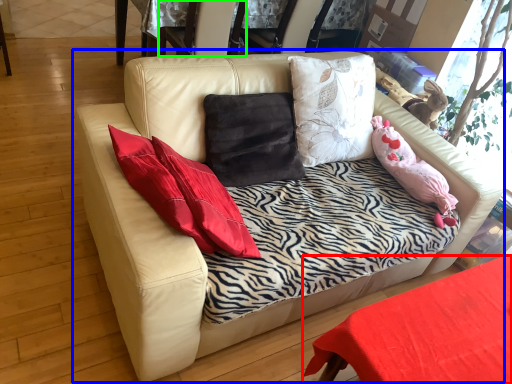
Question: Which object is positioned closest to table (highlighted by a red box)? Select from studio couch (highlighted by a blue box) and armchair (highlighted by a green box).

Choices:
 (A) studio couch
 (B) armchair

Answer: (A)